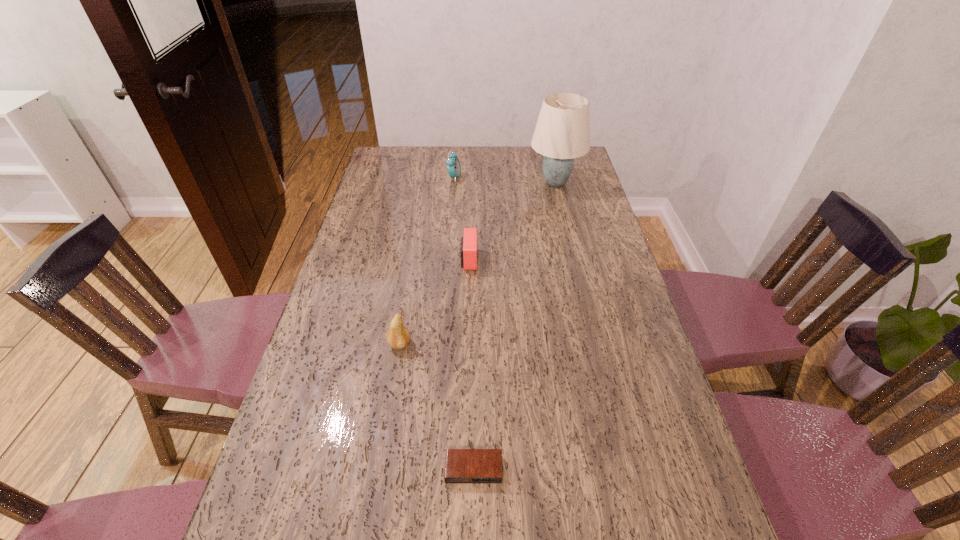
What are the coordinates of `empty location between the leftmost alarm clock and the leftmost object` in the screenshot? It's located at (427, 261).

The width and height of the screenshot is (960, 540). I want to click on free space between the second tallest alarm clock and the leftmost object, so click(x=434, y=302).

This screenshot has height=540, width=960. Find the location of `vacant space that is in between the shortest object and the pear`. vacant space that is in between the shortest object and the pear is located at coordinates (437, 407).

Point out which object is positioned as the fourth nearest to the lampshade. Please provide its 2D coordinates. Your answer should be formatted as a tuple, i.e. [(x, y)], where the tuple contains the x and y coordinates of a point satisfying the conditions above.

[(462, 466)]

Select which object is the fourth closest to the nearest object. Please provide its 2D coordinates. Your answer should be formatted as a tuple, i.e. [(x, y)], where the tuple contains the x and y coordinates of a point satisfying the conditions above.

[(453, 165)]

Identify which alarm clock is located as the second nearest to the leftmost object. Please provide its 2D coordinates. Your answer should be formatted as a tuple, i.e. [(x, y)], where the tuple contains the x and y coordinates of a point satisfying the conditions above.

[(462, 466)]

Select which alarm clock is the second closest to the nearest object. Please provide its 2D coordinates. Your answer should be formatted as a tuple, i.e. [(x, y)], where the tuple contains the x and y coordinates of a point satisfying the conditions above.

[(453, 165)]

The image size is (960, 540). What are the coordinates of `blank area in the image that satisfies the following two spatial constraints: 1. on the face of the tallest alarm clock; 2. on the front side of the second nearest object` in the screenshot? It's located at (441, 344).

Identify the location of free space that satisfies the following two spatial constraints: 1. on the face of the tallest alarm clock; 2. on the back side of the lampshade. (454, 183).